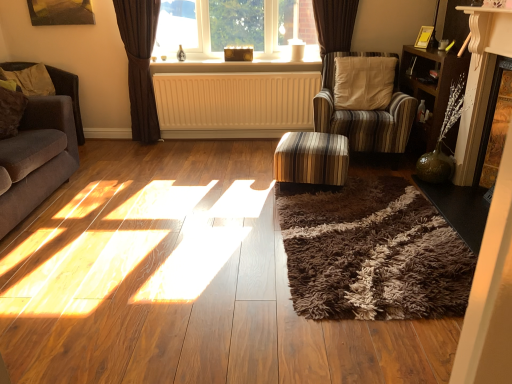
Question: Is striped fabric ottoman at center completely or partially outside of soft beige fabric pillow at left?

Choices:
 (A) no
 (B) yes

Answer: (B)

Question: Is striped fabric ottoman at center aimed at soft beige fabric pillow at left?

Choices:
 (A) yes
 (B) no

Answer: (B)

Question: Can you see striped fabric ottoman at center touching soft beige fabric pillow at left?

Choices:
 (A) no
 (B) yes

Answer: (A)

Question: From the image's perspective, is striped fabric ottoman at center on top of soft beige fabric pillow at left?

Choices:
 (A) no
 (B) yes

Answer: (A)

Question: Does striped fabric ottoman at center come behind soft beige fabric pillow at left?

Choices:
 (A) yes
 (B) no

Answer: (B)

Question: Considering their positions, is velvet brown couch at left located in front of or behind clear glass window at center?

Choices:
 (A) front
 (B) behind

Answer: (A)

Question: Looking at their shapes, would you say velvet brown couch at left is wider or thinner than clear glass window at center?

Choices:
 (A) thin
 (B) wide

Answer: (B)

Question: From the image's perspective, is velvet brown couch at left above or below clear glass window at center?

Choices:
 (A) above
 (B) below

Answer: (B)

Question: Considering the positions of velvet brown couch at left and clear glass window at center in the image, is velvet brown couch at left bigger or smaller than clear glass window at center?

Choices:
 (A) small
 (B) big

Answer: (B)

Question: In terms of width, does wooden bookshelf at right look wider or thinner when compared to brown fabric curtain at upper center?

Choices:
 (A) thin
 (B) wide

Answer: (B)

Question: Is wooden bookshelf at right bigger or smaller than brown fabric curtain at upper center?

Choices:
 (A) small
 (B) big

Answer: (B)

Question: Visually, is wooden bookshelf at right positioned to the left or to the right of brown fabric curtain at upper center?

Choices:
 (A) left
 (B) right

Answer: (B)

Question: Does point (419, 130) appear closer or farther from the camera than point (148, 3)?

Choices:
 (A) farther
 (B) closer

Answer: (B)

Question: From the image's perspective, is white plastic radiator at center located above or below velvet brown couch at left?

Choices:
 (A) above
 (B) below

Answer: (A)

Question: Is white plastic radiator at center situated inside velvet brown couch at left or outside?

Choices:
 (A) inside
 (B) outside

Answer: (B)